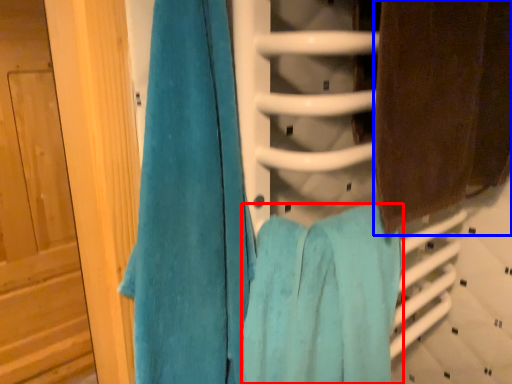
Question: Which of the following is the farthest to the observer, towel (highlighted by a red box) or towel (highlighted by a blue box)?

Choices:
 (A) towel
 (B) towel

Answer: (B)